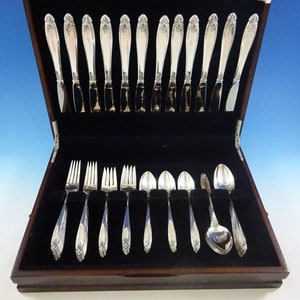
Image resolution: width=300 pixels, height=300 pixels. In order to click on spoons in this screenshot , I will do `click(147, 183)`, `click(166, 180)`, `click(215, 232)`, `click(188, 182)`, `click(228, 178)`.